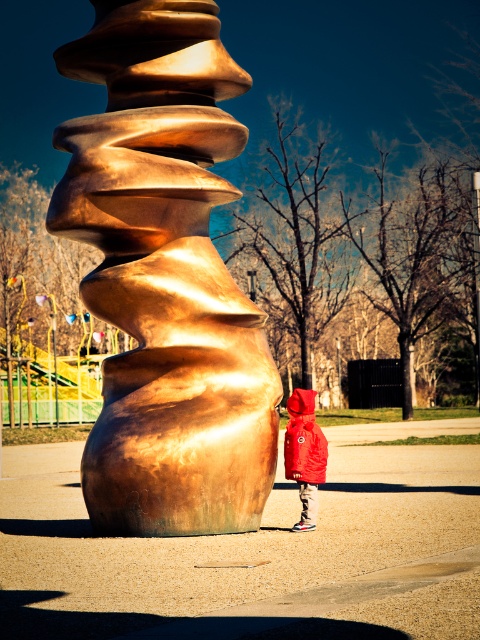
Measure the distance between point (180, 368) and camera.

15.39 meters

Can you confirm if gold polished spiral at center is positioned below matte red jacket at center?

Actually, gold polished spiral at center is above matte red jacket at center.

Between point (255, 339) and point (313, 456), which one is positioned in front?

Point (313, 456)

Where is `gold polished spiral at center`? Image resolution: width=480 pixels, height=640 pixels. gold polished spiral at center is located at coordinates (166, 276).